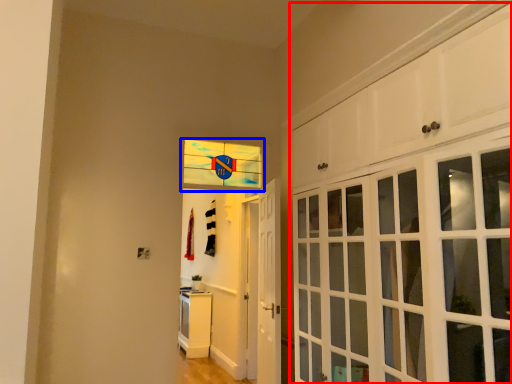
Question: Which point is further to the camera, cabinetry (highlighted by a red box) or window (highlighted by a blue box)?

Choices:
 (A) cabinetry
 (B) window

Answer: (B)